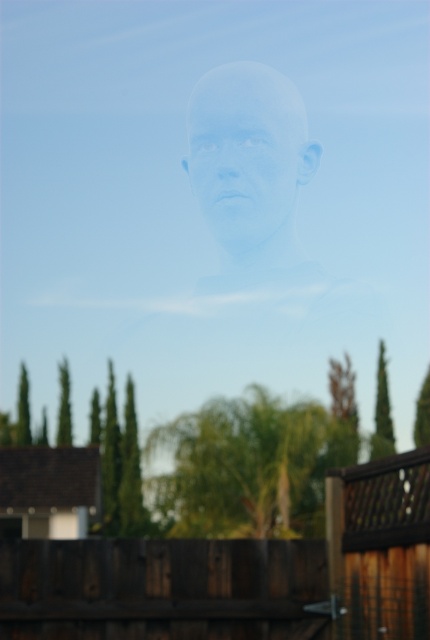
Question: Is brown wooden fence at lower center to the right of translucent white head at center from the viewer's perspective?

Choices:
 (A) yes
 (B) no

Answer: (B)

Question: Which point appears closest to the camera in this image?

Choices:
 (A) (215, 195)
 (B) (187, 605)

Answer: (B)

Question: Which point is closer to the camera?

Choices:
 (A) (226, 170)
 (B) (267, 104)
 (C) (289, 624)

Answer: (C)

Question: Is brown wooden fence at lower center smaller than translucent white head at center?

Choices:
 (A) no
 (B) yes

Answer: (A)

Question: In this image, where is translucent plastic head at center located relative to translucent white head at center?

Choices:
 (A) right
 (B) left

Answer: (A)

Question: Based on their relative distances, which object is nearer to the translucent white head at center?

Choices:
 (A) translucent plastic head at center
 (B) brown wooden fence at lower center

Answer: (A)